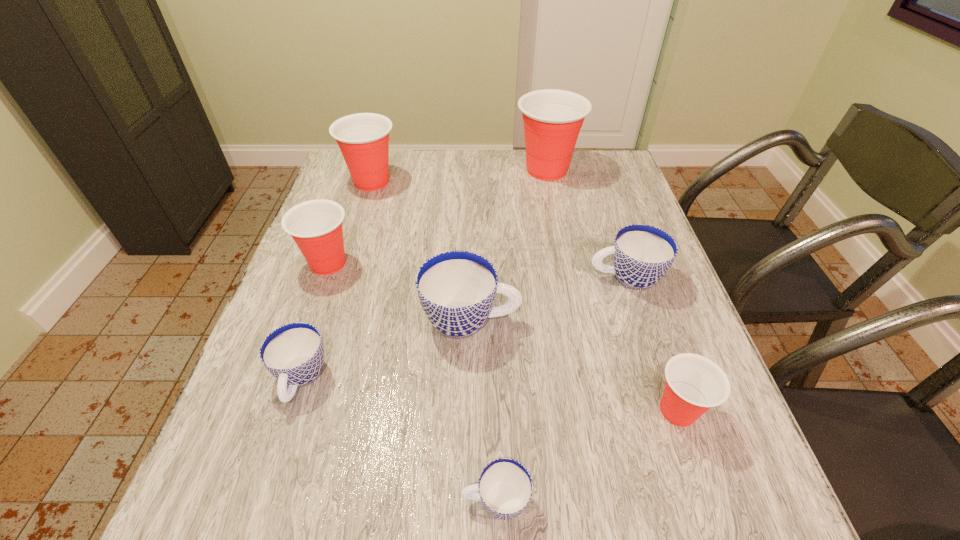
Image resolution: width=960 pixels, height=540 pixels. What are the coordinates of `the tallest object` in the screenshot? It's located at (552, 118).

What are the coordinates of `the biggest red cup` in the screenshot? It's located at (552, 118).

This screenshot has width=960, height=540. Identify the location of the third smallest red cup. (363, 138).

This screenshot has width=960, height=540. Identify the location of the second tallest object. (363, 138).

I want to click on the third farthest red cup, so click(x=316, y=226).

At what (x,y) coordinates should I click in order to perform the action: click on the biggest blue cup. Please return your answer as a coordinate pair (x, y). The height and width of the screenshot is (540, 960). Looking at the image, I should click on (457, 289).

At what (x,y) coordinates should I click in order to perform the action: click on the rightmost blue cup. Please return your answer as a coordinate pair (x, y). The height and width of the screenshot is (540, 960). Looking at the image, I should click on (642, 254).

At what (x,y) coordinates should I click in order to perform the action: click on the nearest red cup. Please return your answer as a coordinate pair (x, y). The width and height of the screenshot is (960, 540). Looking at the image, I should click on (694, 383).

Where is `the leftmost blue cup`? the leftmost blue cup is located at coordinates (294, 353).

At what (x,y) coordinates should I click in order to perform the action: click on the seventh tallest cup. Please return your answer as a coordinate pair (x, y). Looking at the image, I should click on (294, 353).